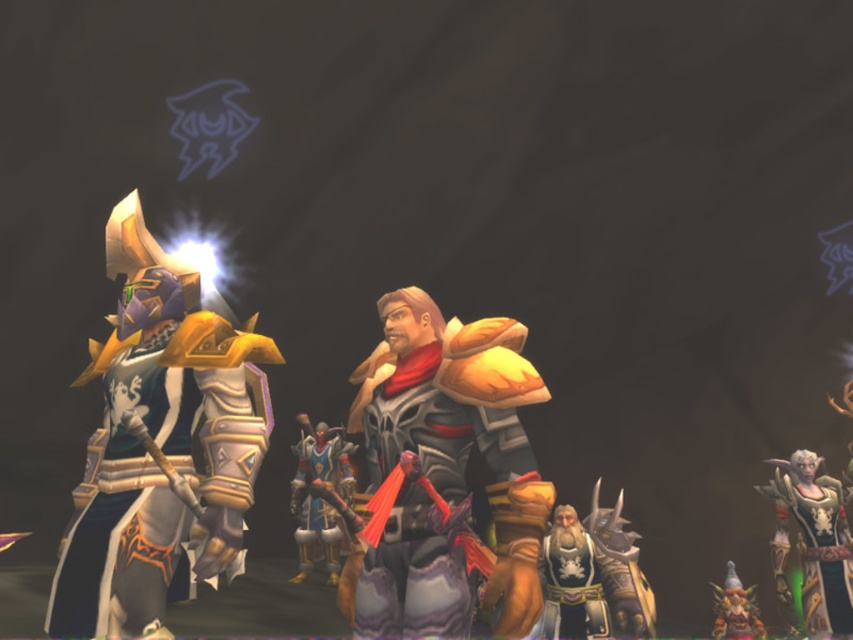
Consider the image. You are a game developer working on a fantasy RPG. You need to determine which character has a larger armor size between the shiny gold armor at left and the gold plated armor at left based on their visual representation in the game scene. Which one is bigger?

The shiny gold armor at left is bigger than the gold plated armor at left according to the description.

You are standing at the point marked as point (172,512) in the image. You want to walk to the exit located at the northernmost part of the room. Which direction should you head?

Since point (172,512) is 2.72 meters away from the viewer, you should head north to reach the exit located at the northernmost part of the room.

You are navigating through a dark dungeon in the game and need to locate the shiny gold armor at left. Based on its coordinates at point 0.697, 0.190, can you determine its position relative to the center of the screen?

The shiny gold armor at left is located at coordinates (161,445), which places it to the right and slightly above the center of the screen. Since the coordinate system typically starts from the bottom left corner, 0.697 on the x axis indicates it is more than halfway to the right, and 0.190 on the y axis means it is below the top third of the screen but above the center.